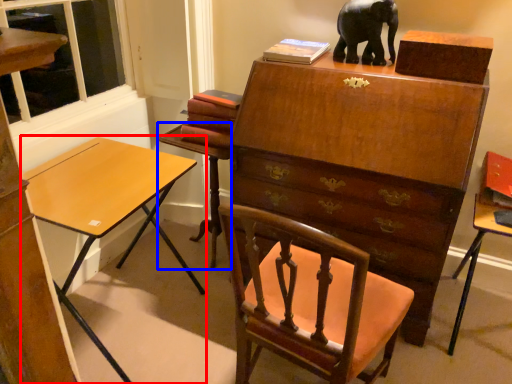
Question: Which object is further to the camera taking this photo, desk (highlighted by a red box) or table (highlighted by a blue box)?

Choices:
 (A) desk
 (B) table

Answer: (B)